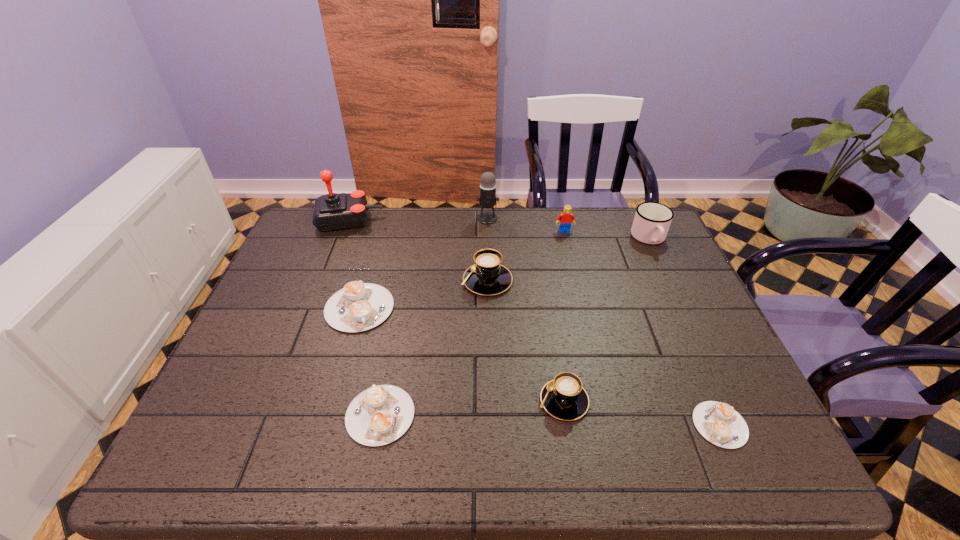
Locate an element on the screen. This screenshot has height=540, width=960. the seventh tallest object is located at coordinates (359, 306).

Find the location of a particular element. The height and width of the screenshot is (540, 960). the fourth tallest cappuccino is located at coordinates (379, 415).

I want to click on the second smallest white cappuccino, so [379, 415].

This screenshot has width=960, height=540. I want to click on the rightmost cappuccino, so click(x=719, y=423).

Where is `the smallest white cappuccino`? the smallest white cappuccino is located at coordinates (719, 423).

What are the coordinates of `free location located 0.370m on the front of the joystick` in the screenshot? It's located at (310, 320).

Find the location of a particular element. The width and height of the screenshot is (960, 540). free region located on the front of the microphone is located at coordinates (490, 313).

Find the location of a particular element. This screenshot has height=540, width=960. free space located 0.140m on the face of the red Lego is located at coordinates (571, 261).

Find the location of a particular element. This screenshot has width=960, height=540. vacant space located 0.160m on the side of the mug with the handle is located at coordinates (673, 289).

Find the location of a particular element. vacant space located 0.250m on the right of the bigger black cappuccino is located at coordinates (601, 281).